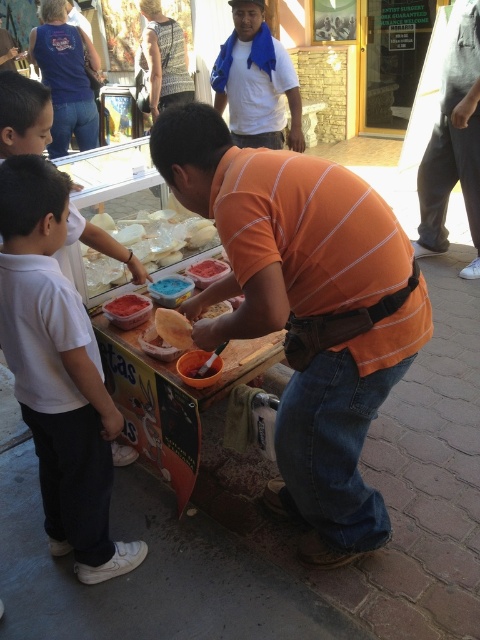
Can you confirm if blue fabric scarf at upper center is positioned to the right of matte brown bread at center?

Correct, you'll find blue fabric scarf at upper center to the right of matte brown bread at center.

Who is positioned more to the left, blue fabric scarf at upper center or matte brown bread at center?

matte brown bread at center

Which is behind, point (254, 60) or point (163, 328)?

The point (254, 60) is more distant.

In order to click on blue fabric scarf at upper center in this screenshot , I will do `click(256, 81)`.

Does white shirt at left appear on the left side of white creamy cheese at center?

Correct, you'll find white shirt at left to the left of white creamy cheese at center.

Can you confirm if white shirt at left is positioned below white creamy cheese at center?

No, white shirt at left is not below white creamy cheese at center.

Between point (74, 182) and point (86, 256), which one is positioned in front?

Positioned in front is point (74, 182).

Locate an element on the screen. This screenshot has width=480, height=640. white shirt at left is located at coordinates (24, 115).

What do you see at coordinates (256, 81) in the screenshot? I see `blue fabric scarf at upper center` at bounding box center [256, 81].

Is point (265, 65) positioned behind point (214, 259)?

Yes, point (265, 65) is farther from viewer.

Find the location of `blue fabric scarf at upper center`. blue fabric scarf at upper center is located at coordinates (256, 81).